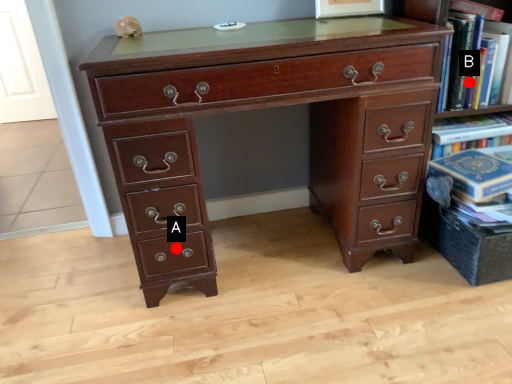
Question: Two points are circled on the image, labeled by A and B beside each circle. Which point is closer to the camera taking this photo?

Choices:
 (A) A is closer
 (B) B is closer

Answer: (A)